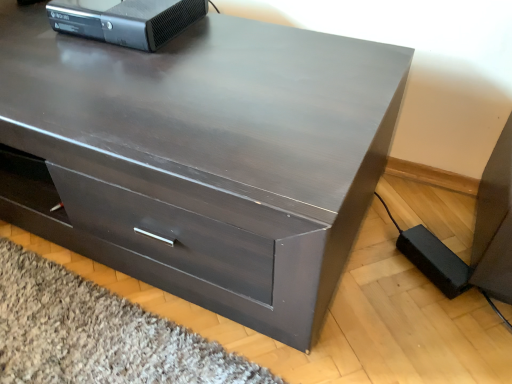
You are a GUI agent. You are given a task and a screenshot of the screen. Output one action in this format:
    pyautogui.click(x=<x>, y=<y>)
    Task: Click on the free space in front of black plastic xbox 360 at upper left
    This screenshot has width=512, height=384.
    Given the screenshot: What is the action you would take?
    pyautogui.click(x=112, y=72)